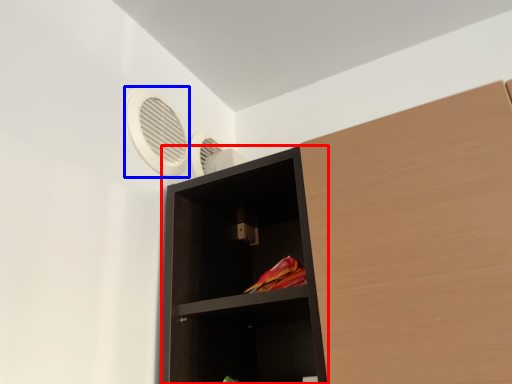
Question: Which object is further to the camera taking this photo, shelf (highlighted by a red box) or fan (highlighted by a blue box)?

Choices:
 (A) shelf
 (B) fan

Answer: (B)